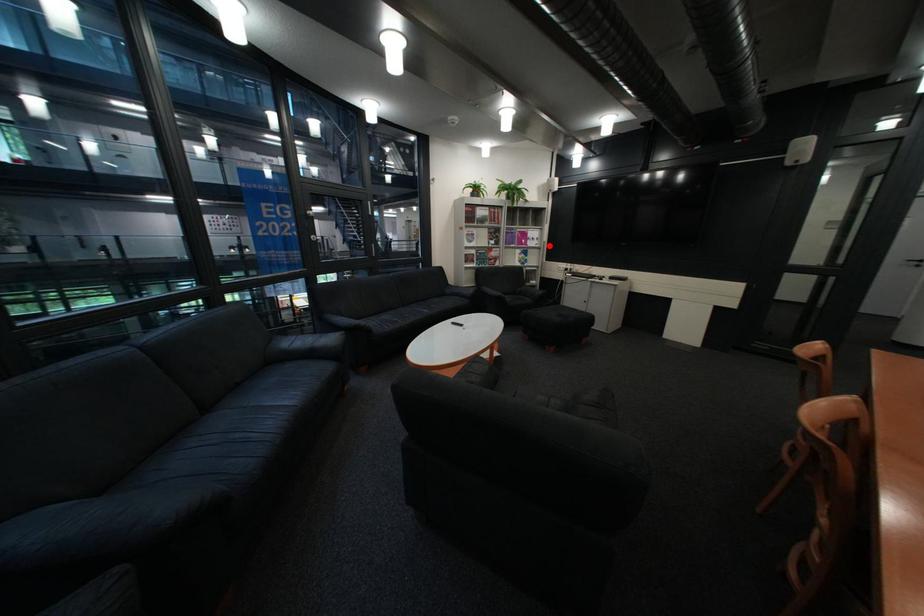
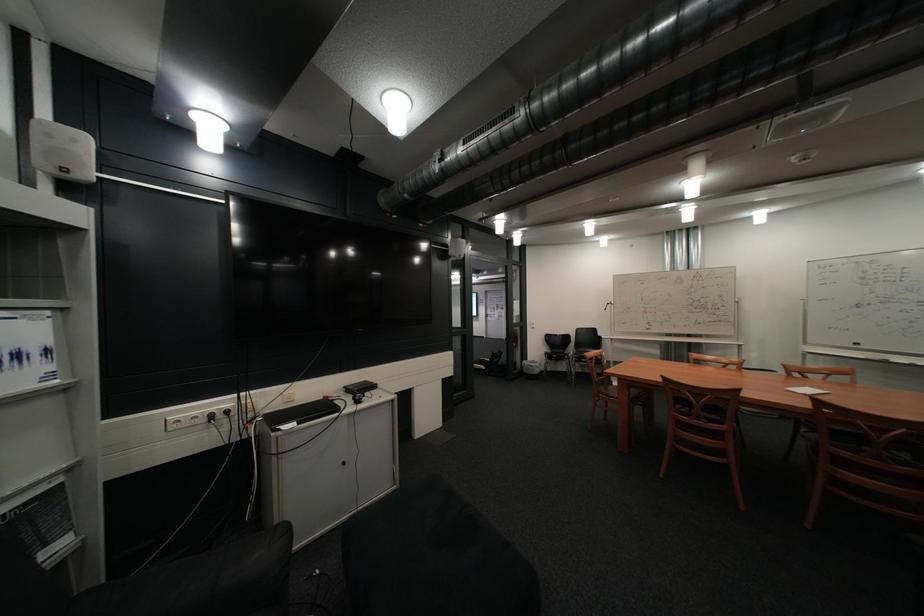
Question: A red point is marked in image1. In image2, is the corresponding 3D point closer to the camera or farther? Reply with the corresponding letter.

Choices:
 (A) The corresponding 3D point is closer.
 (B) The corresponding 3D point is farther.

Answer: (B)